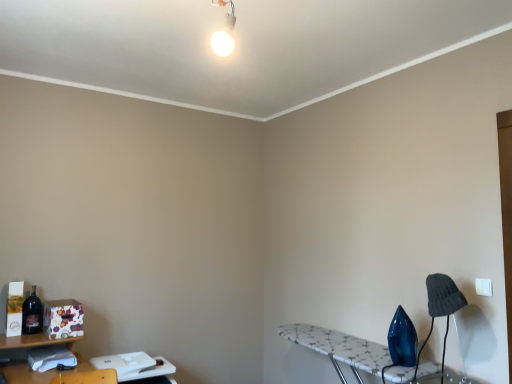
Question: Can you confirm if matte dark blue bottle at left is smaller than white plastic table at lower left, which is the 2th table from right to left?

Choices:
 (A) no
 (B) yes

Answer: (B)

Question: Could white plastic table at lower left, which is the 2th table from right to left, be considered to be inside matte dark blue bottle at left?

Choices:
 (A) no
 (B) yes

Answer: (A)

Question: Considering the relative positions of matte dark blue bottle at left and white plastic table at lower left, which is counted as the 1th table, starting from the left, in the image provided, is matte dark blue bottle at left to the left of white plastic table at lower left, which is counted as the 1th table, starting from the left, from the viewer's perspective?

Choices:
 (A) yes
 (B) no

Answer: (A)

Question: Considering the relative sizes of matte dark blue bottle at left and white plastic table at lower left, which is the 2th table from right to left, in the image provided, is matte dark blue bottle at left wider than white plastic table at lower left, which is the 2th table from right to left,?

Choices:
 (A) no
 (B) yes

Answer: (A)

Question: Is the position of matte dark blue bottle at left more distant than that of white plastic table at lower left, which is the 2th table from right to left?

Choices:
 (A) no
 (B) yes

Answer: (B)

Question: From a real-world perspective, is matte dark blue bottle at left positioned above or below white glossy bulb at upper center?

Choices:
 (A) above
 (B) below

Answer: (B)

Question: In terms of width, does matte dark blue bottle at left look wider or thinner when compared to white glossy bulb at upper center?

Choices:
 (A) thin
 (B) wide

Answer: (B)

Question: Based on their sizes in the image, would you say matte dark blue bottle at left is bigger or smaller than white glossy bulb at upper center?

Choices:
 (A) big
 (B) small

Answer: (B)

Question: Is matte dark blue bottle at left taller or shorter than white glossy bulb at upper center?

Choices:
 (A) tall
 (B) short

Answer: (B)

Question: In the image, is white mosaic ironing board at lower right, the second table from the left, positioned in front of or behind dark gray fabric lampshade at lower right?

Choices:
 (A) behind
 (B) front

Answer: (B)

Question: Do you think white mosaic ironing board at lower right, positioned as the first table in right-to-left order, is within dark gray fabric lampshade at lower right, or outside of it?

Choices:
 (A) inside
 (B) outside

Answer: (B)

Question: Is white mosaic ironing board at lower right, positioned as the first table in right-to-left order, wider or thinner than dark gray fabric lampshade at lower right?

Choices:
 (A) thin
 (B) wide

Answer: (B)

Question: Considering the positions of white mosaic ironing board at lower right, positioned as the first table in right-to-left order, and dark gray fabric lampshade at lower right in the image, is white mosaic ironing board at lower right, positioned as the first table in right-to-left order, taller or shorter than dark gray fabric lampshade at lower right?

Choices:
 (A) short
 (B) tall

Answer: (A)

Question: Is white glossy bulb at upper center wider or thinner than white mosaic ironing board at lower right, positioned as the first table in right-to-left order?

Choices:
 (A) wide
 (B) thin

Answer: (B)

Question: Is point (216, 51) closer or farther from the camera than point (309, 340)?

Choices:
 (A) farther
 (B) closer

Answer: (B)